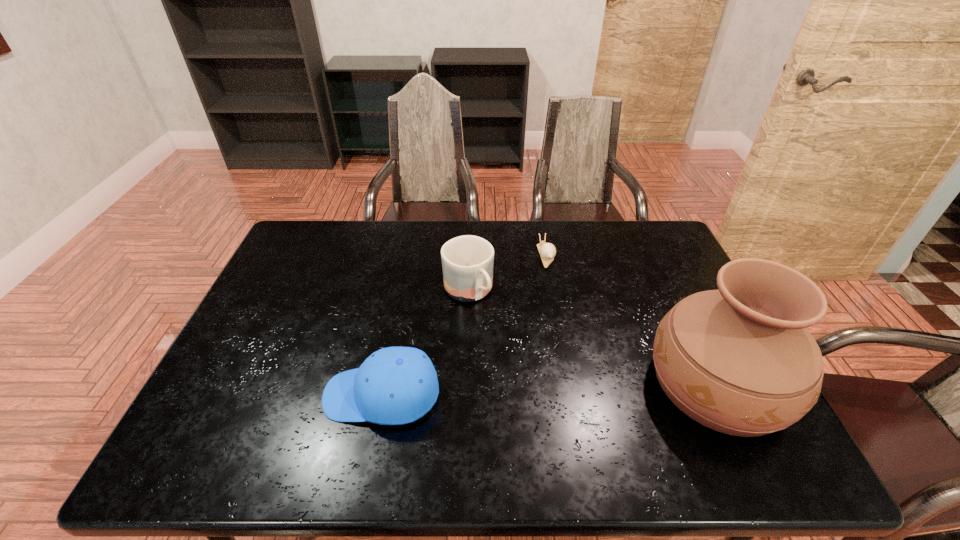
Image resolution: width=960 pixels, height=540 pixels. In order to click on vacant space on the desktop that is between the cap and the urn and is positioned on the side with the handle of the third nearest object in this screenshot , I will do `click(545, 389)`.

The image size is (960, 540). In order to click on free spot on the desktop that is between the cap and the urn and is positioned on the shell of the third object from left to right in this screenshot , I will do `click(595, 388)`.